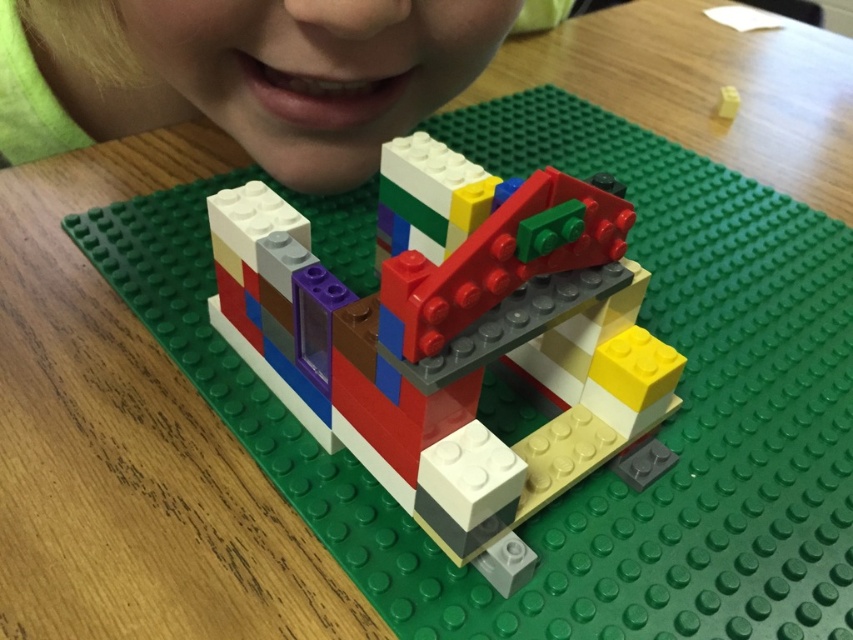
Can you confirm if multicolored plastic building block at center is wider than matte green lego brick at upper center?

No.

Is multicolored plastic building block at center bigger than matte green lego brick at upper center?

Incorrect, multicolored plastic building block at center is not larger than matte green lego brick at upper center.

Locate an element on the screen. This screenshot has height=640, width=853. multicolored plastic building block at center is located at coordinates (462, 340).